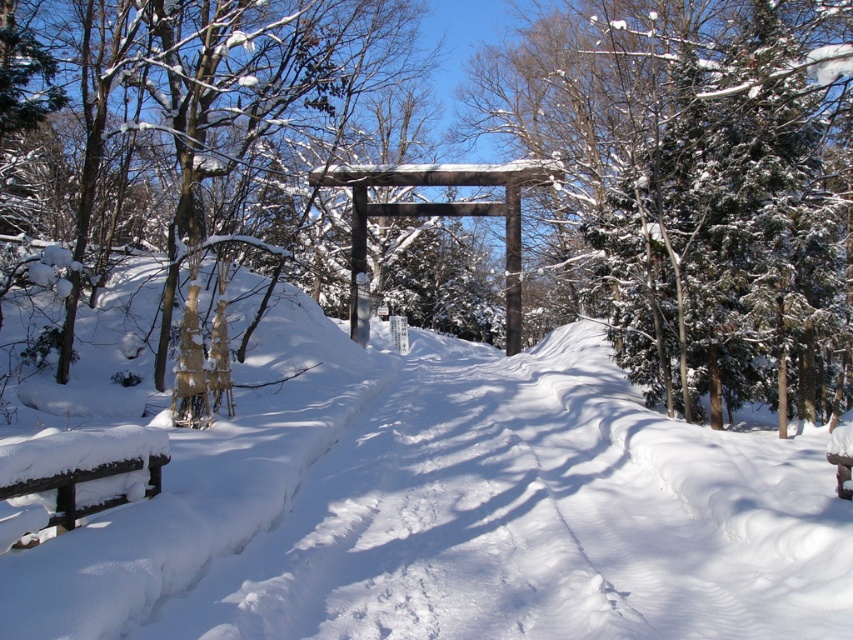
Between snow-covered tree at center and white fluffy snow at center, which one has more height?

snow-covered tree at center is taller.

In the scene shown: Can you confirm if snow-covered tree at center is bigger than white fluffy snow at center?

Indeed, snow-covered tree at center has a larger size compared to white fluffy snow at center.

Does point (335, 88) come in front of point (407, 579)?

No.

Where is `snow-covered tree at center`? The image size is (853, 640). snow-covered tree at center is located at coordinates (552, 188).

Can you confirm if snow-covered tree at center is bigger than wooden bench at lower left?

Indeed, snow-covered tree at center has a larger size compared to wooden bench at lower left.

Is snow-covered tree at center taller than wooden bench at lower left?

Yes, snow-covered tree at center is taller than wooden bench at lower left.

Is point (671, 182) behind point (41, 486)?

That is True.

I want to click on snow-covered tree at center, so click(552, 188).

Can you confirm if white fluffy snow at center is positioned above wooden bench at lower left?

Incorrect, white fluffy snow at center is not positioned above wooden bench at lower left.

Is white fluffy snow at center positioned before wooden bench at lower left?

Yes, it is.

Who is more forward, (x=729, y=522) or (x=103, y=452)?

Positioned in front is point (x=103, y=452).

Locate an element on the screen. white fluffy snow at center is located at coordinates (450, 508).